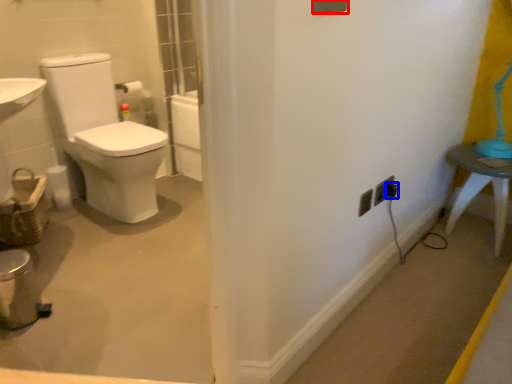
Question: Which object appears farthest to the camera in this image, light switch (highlighted by a red box) or electric outlet (highlighted by a blue box)?

Choices:
 (A) light switch
 (B) electric outlet

Answer: (B)